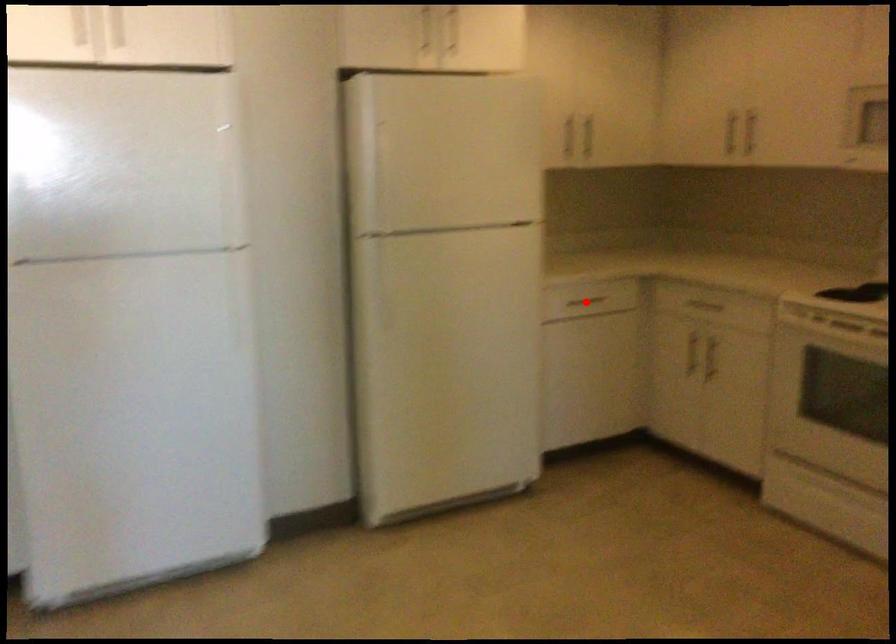
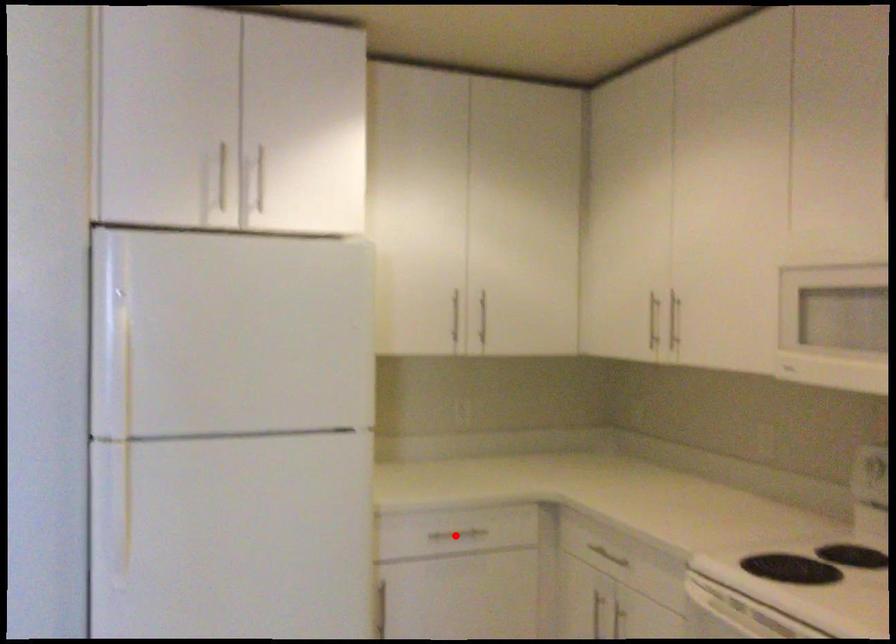
Consider the image. I am providing you with two images of the same scene from different viewpoints. A red point is marked on the first image and another point is marked on the second image. Is the marked point in image1 the same physical position as the marked point in image2?

Yes